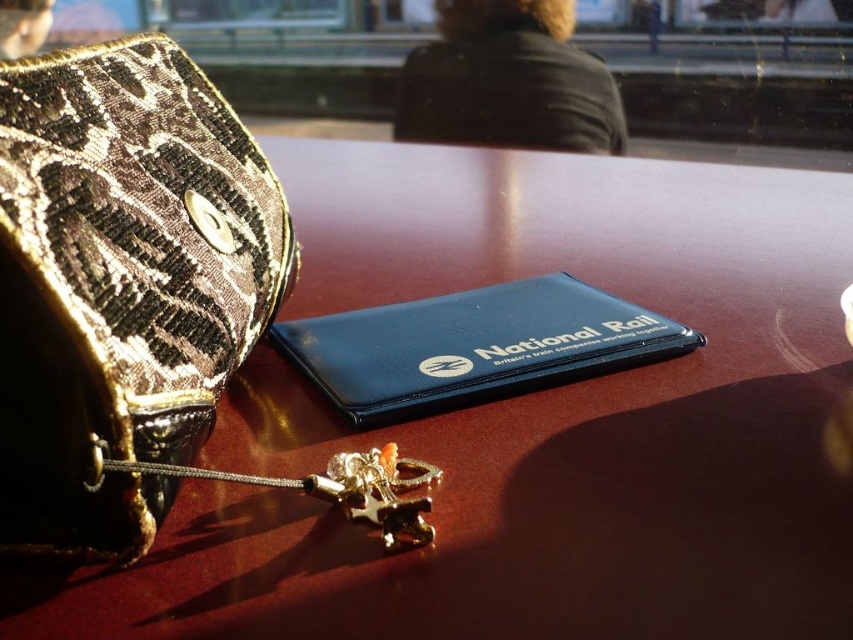
You are organizing items on a table and need to place a phone between the leather textured bag at left and the matte black wallet at center. Can the phone fit in the space between them?

The space between the leather textured bag at left and the matte black wallet at center is 18.59 centimeters. Since the phone is smaller than 18.59 centimeters, it can fit in the space between them.

You are looking at the table and need to determine the spatial relationship between two points. Which point is closer to you, point at coordinates (228, 125) or point at coordinates (358, 493)?

Point at coordinates (358, 493) is closer to you because the description states that point at coordinates (228, 125) is behind point at coordinates (358, 493).